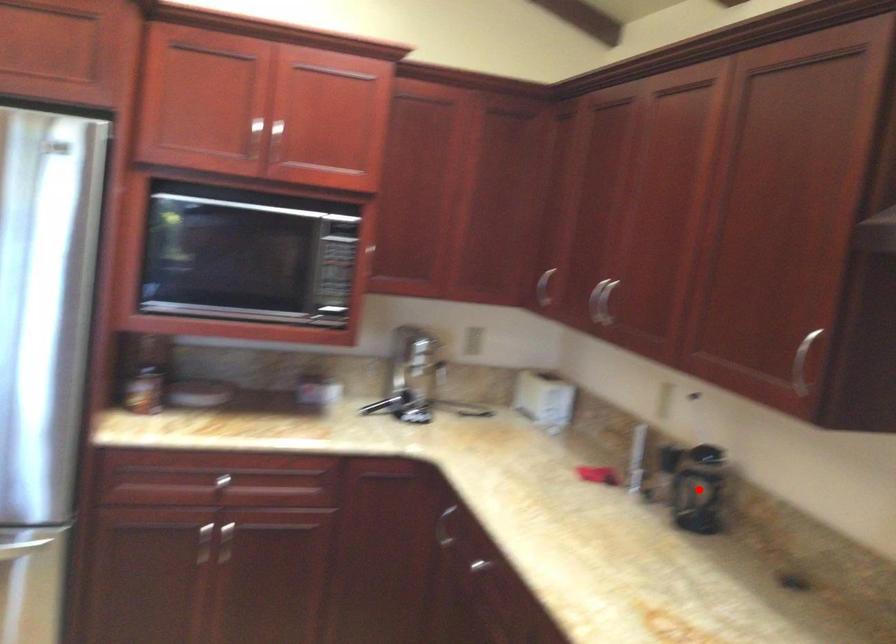
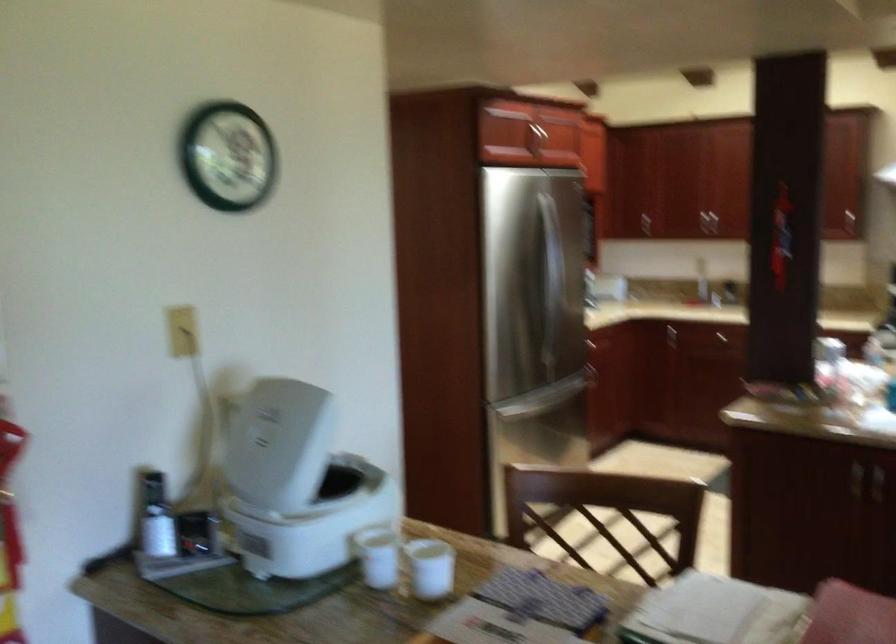
Question: I am providing you with two images of the same scene from different viewpoints. A red point is marked on the first image. Is the red point's position out of view in image 2?

Choices:
 (A) Yes
 (B) No

Answer: (A)